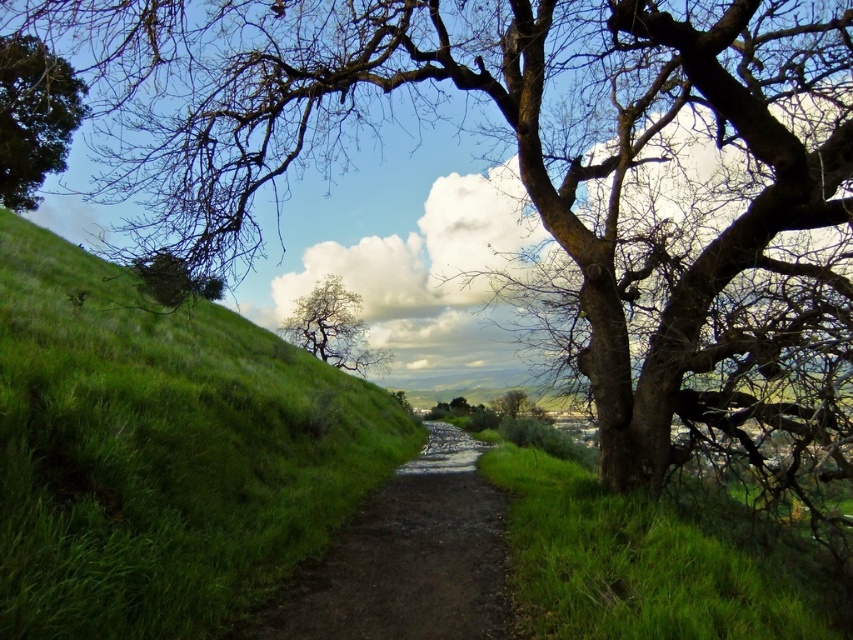
You are an artist planning to paint the two trees at the center of the image. Which tree, the bare branches tree at center or the bare wood tree at center, should you depict as taller in your painting?

The bare branches tree at center should be depicted as taller because it has a greater height compared to the bare wood tree at center according to the description.

You are standing on the dirt path and want to walk towards the bare wood tree at center. Which direction should you head to avoid the green grassy hillside at left?

To reach the bare wood tree at center while avoiding the green grassy hillside at left, you should head to the right side of the path since the green grassy hillside at left is located to the left of the tree.

You are standing at the point marked as point (x=334, y=328) in the image. What do you see directly in front of you?

You see a bare branches tree at center directly in front of you at point (x=334, y=328).